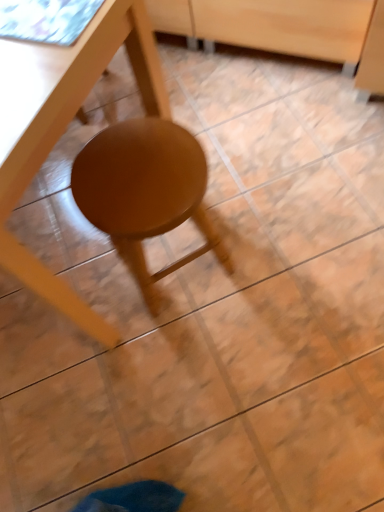
Question: Is matte wood stool at center situated inside matte wood table at center or outside?

Choices:
 (A) inside
 (B) outside

Answer: (A)

Question: Is point (188, 176) positioned closer to the camera than point (23, 257)?

Choices:
 (A) farther
 (B) closer

Answer: (A)

Question: Which is nearer to the matte wood stool at center?

Choices:
 (A) wooden drawer at center
 (B) matte wood table at center

Answer: (B)

Question: Which is nearer to the matte wood stool at center?

Choices:
 (A) wooden drawer at center
 (B) matte wood table at center

Answer: (B)